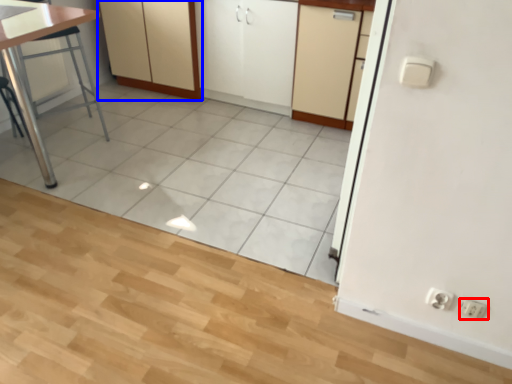
Question: Which object is further to the camera taking this photo, electric outlet (highlighted by a red box) or cabinetry (highlighted by a blue box)?

Choices:
 (A) electric outlet
 (B) cabinetry

Answer: (B)